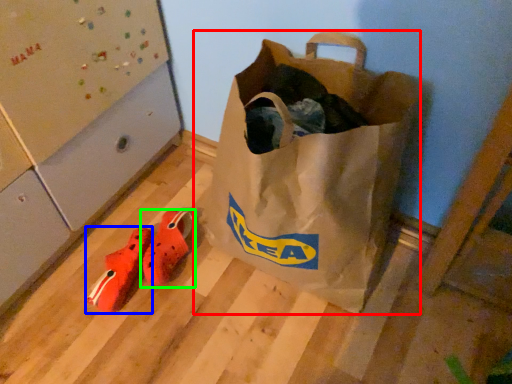
Question: Which object is positioned closest to luggage and bags (highlighted by a red box)? Select from shoe (highlighted by a blue box) and footwear (highlighted by a green box).

Choices:
 (A) shoe
 (B) footwear

Answer: (B)